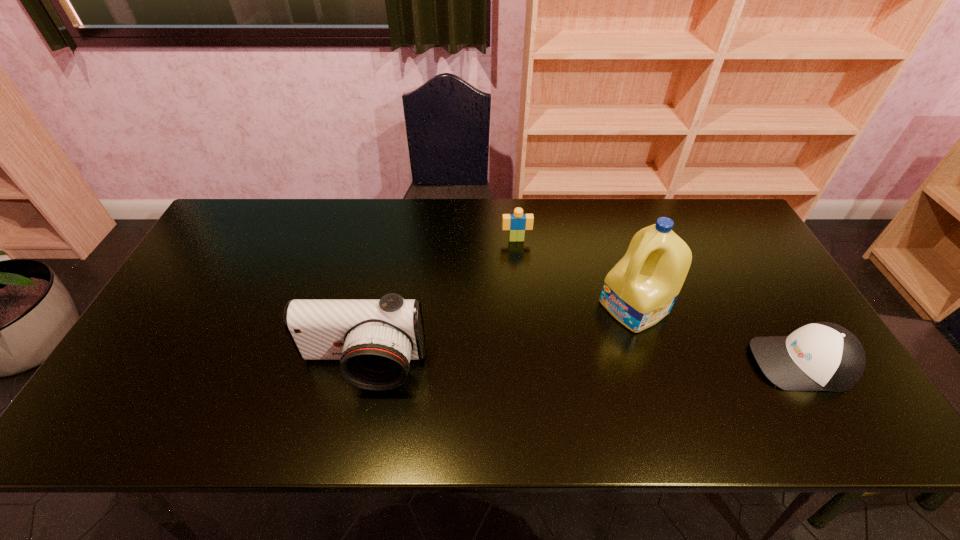
The width and height of the screenshot is (960, 540). I want to click on vacant space on the desktop that is between the leftmost object and the cap and is positioned on the label of the detergent, so click(x=536, y=365).

The image size is (960, 540). I want to click on vacant spot on the desktop that is between the second tallest object and the cap and is positioned on the face of the third object from right to left, so click(x=532, y=365).